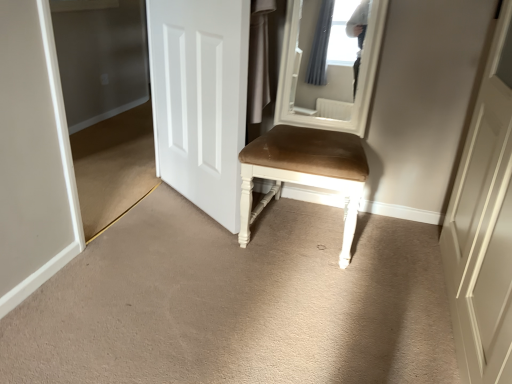
Question: Can you confirm if white matte door at center is smaller than suede-like brown chair at center?

Choices:
 (A) yes
 (B) no

Answer: (A)

Question: Does white matte door at center have a greater width compared to suede-like brown chair at center?

Choices:
 (A) yes
 (B) no

Answer: (B)

Question: Is white matte door at center not inside suede-like brown chair at center?

Choices:
 (A) no
 (B) yes

Answer: (B)

Question: Is white matte door at center placed right next to suede-like brown chair at center?

Choices:
 (A) yes
 (B) no

Answer: (B)

Question: From a real-world perspective, is white matte door at center positioned under suede-like brown chair at center based on gravity?

Choices:
 (A) no
 (B) yes

Answer: (A)

Question: Can you confirm if white matte door at center is bigger than suede-like brown chair at center?

Choices:
 (A) no
 (B) yes

Answer: (A)

Question: Can you confirm if white matte door at center is thinner than transparent glass door at left?

Choices:
 (A) no
 (B) yes

Answer: (A)

Question: Can we say white matte door at center lies outside transparent glass door at left?

Choices:
 (A) yes
 (B) no

Answer: (A)

Question: Is white matte door at center positioned with its back to transparent glass door at left?

Choices:
 (A) no
 (B) yes

Answer: (B)

Question: Can you confirm if white matte door at center is smaller than transparent glass door at left?

Choices:
 (A) yes
 (B) no

Answer: (B)

Question: Is white matte door at center shorter than transparent glass door at left?

Choices:
 (A) yes
 (B) no

Answer: (A)

Question: From the image's perspective, is white matte door at center on top of transparent glass door at left?

Choices:
 (A) no
 (B) yes

Answer: (B)

Question: Is transparent glass door at left taller than suede-like brown chair at center?

Choices:
 (A) yes
 (B) no

Answer: (A)